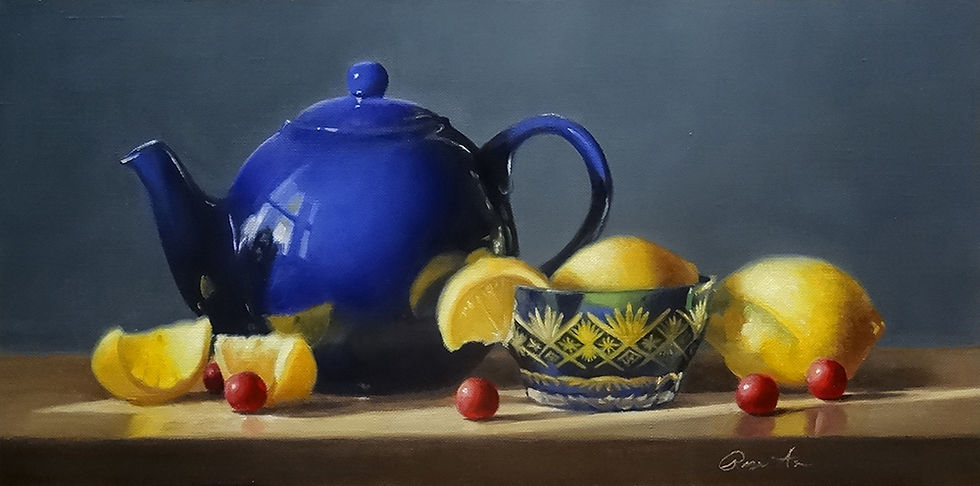
At what (x,y) coordinates should I click in order to perform the action: click on oil painting. Please return your answer as a coordinate pair (x, y). Looking at the image, I should click on (469, 205).